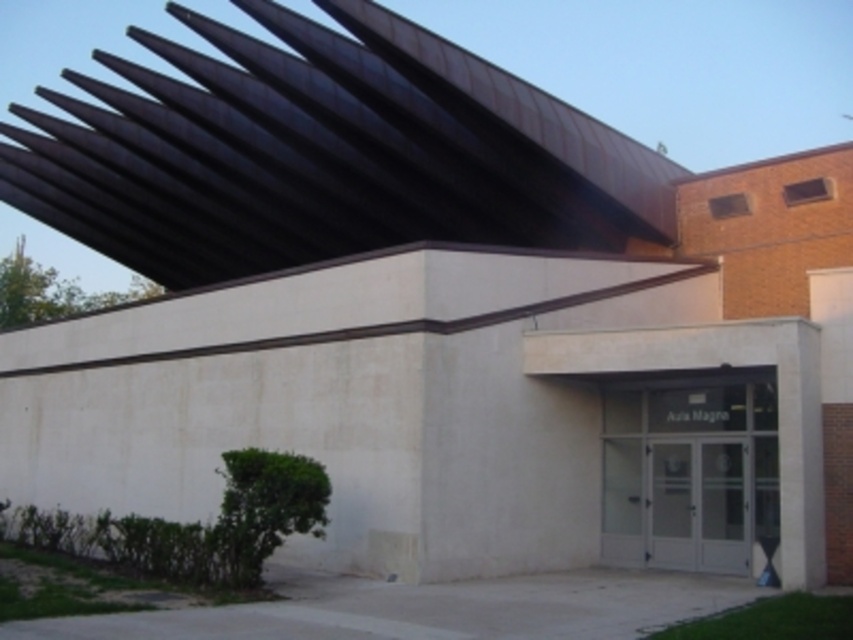
You are an architect evaluating the building design. You need to determine if the black corrugated metal roof at upper center can provide sufficient shade to the clear glass doors at center during midday. Based on their sizes, what is your assessment?

The black corrugated metal roof at upper center is bigger than the clear glass doors at center, so it can provide sufficient shade to the clear glass doors at center during midday.